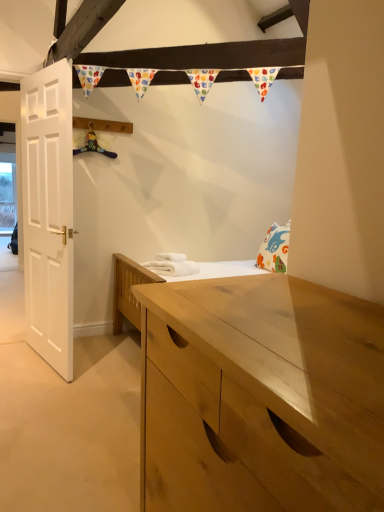
The width and height of the screenshot is (384, 512). What do you see at coordinates (48, 213) in the screenshot?
I see `white matte door at left` at bounding box center [48, 213].

At what (x,y) coordinates should I click in order to perform the action: click on white matte door at left. Please return your answer as a coordinate pair (x, y). This screenshot has width=384, height=512. Looking at the image, I should click on (48, 213).

You are a GUI agent. You are given a task and a screenshot of the screen. Output one action in this format:
    pyautogui.click(x=<x>, y=<y>)
    Task: Click on the white soft towels at center
    
    Given the screenshot: What is the action you would take?
    pyautogui.click(x=172, y=265)

Describe the element at coordinates (172, 265) in the screenshot. I see `white soft towels at center` at that location.

Locate an element on the screen. white matte door at left is located at coordinates (48, 213).

Considering the relative positions of white matte door at left and white soft towels at center in the image provided, is white matte door at left to the left of white soft towels at center from the viewer's perspective?

Indeed, white matte door at left is positioned on the left side of white soft towels at center.

Considering their positions, is white matte door at left located in front of or behind white soft towels at center?

Clearly, white matte door at left is in front of white soft towels at center.

Which is closer, (65, 261) or (145, 262)?

Positioned in front is point (65, 261).

From the image's perspective, is white matte door at left positioned above or below white soft towels at center?

white matte door at left is above white soft towels at center.

From a real-world perspective, who is located lower, white matte door at left or white soft towels at center?

white soft towels at center, from a real-world perspective.

Considering the sizes of white matte door at left and white soft towels at center in the image, is white matte door at left wider or thinner than white soft towels at center?

In the image, white matte door at left appears to be more narrow than white soft towels at center.

Can you confirm if white matte door at left is taller than white soft towels at center?

Yes, white matte door at left is taller than white soft towels at center.

Which of these two, white matte door at left or white soft towels at center, is bigger?

white matte door at left is bigger.

Is white matte door at left inside or outside of white soft towels at center?

white matte door at left is not inside white soft towels at center, it's outside.

Are white matte door at left and white soft towels at center located far from each other?

white matte door at left is near white soft towels at center, not far away.

Is white matte door at left turned away from white soft towels at center?

Yes, white matte door at left is facing away from white soft towels at center.

How many degrees apart are the facing directions of white matte door at left and white soft towels at center?

The angle between the facing direction of white matte door at left and the facing direction of white soft towels at center is 27.2 degrees.

Identify the location of door above the white soft towels at center (from a real-world perspective). (48, 213).

Visually, is white soft towels at center positioned to the left or to the right of white matte door at left?

Clearly, white soft towels at center is on the right of white matte door at left in the image.

Between white soft towels at center and white matte door at left, which one is positioned in front?

white matte door at left is more forward.

Is point (163, 271) closer or farther from the camera than point (51, 197)?

Point (163, 271) appears to be farther away from the viewer than point (51, 197).

From the image's perspective, which one is positioned higher, white soft towels at center or white matte door at left?

white matte door at left, from the image's perspective.

From a real-world perspective, which object stands above the other?

white matte door at left is physically above.

Consider the image. Considering the sizes of white soft towels at center and white matte door at left in the image, is white soft towels at center wider or thinner than white matte door at left?

In the image, white soft towels at center appears to be wider than white matte door at left.

Which of these two, white soft towels at center or white matte door at left, stands shorter?

Standing shorter between the two is white soft towels at center.

Consider the image. Is white soft towels at center bigger or smaller than white matte door at left?

Clearly, white soft towels at center is smaller in size than white matte door at left.

Choose the correct answer: Is white soft towels at center inside white matte door at left or outside it?

white soft towels at center is outside white matte door at left.

Is white soft towels at center next to white matte door at left and touching it?

No, white soft towels at center is not making contact with white matte door at left.

Is white soft towels at center aimed at white matte door at left?

No, white soft towels at center is not turned towards white matte door at left.

How many degrees apart are the facing directions of white soft towels at center and white matte door at left?

The angle between the facing direction of white soft towels at center and the facing direction of white matte door at left is 27.2 degrees.

How much distance is there between white soft towels at center and white matte door at left?

white soft towels at center and white matte door at left are 92.48 centimeters apart.

Where is `laundry on the right of the white matte door at left`? laundry on the right of the white matte door at left is located at coordinates tap(172, 265).

In the image, there is a white soft towels at center. At what (x,y) coordinates should I click in order to perform the action: click on door above it (from the image's perspective). Please return your answer as a coordinate pair (x, y). The height and width of the screenshot is (512, 384). Looking at the image, I should click on (48, 213).

At what (x,y) coordinates should I click in order to perform the action: click on laundry below the white matte door at left (from the image's perspective). Please return your answer as a coordinate pair (x, y). Looking at the image, I should click on (172, 265).